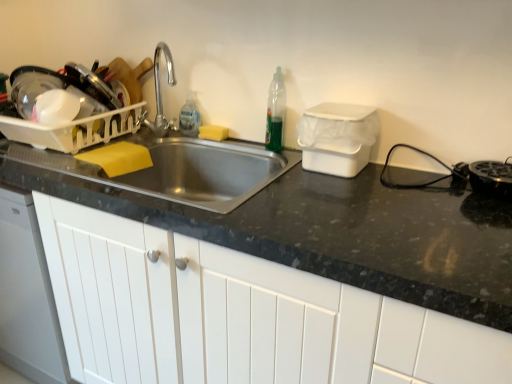
Question: From a real-world perspective, is translucent plastic bottle at sink, which is counted as the first bottle, starting from the back, above or below black plastic toaster at right, the 3th appliance positioned from the left?

Choices:
 (A) below
 (B) above

Answer: (B)

Question: Considering the positions of point (194, 117) and point (490, 167), is point (194, 117) closer or farther from the camera than point (490, 167)?

Choices:
 (A) farther
 (B) closer

Answer: (A)

Question: Which of these objects is positioned farthest from the white plastic dish rack at left, which ranks as the first appliance in left-to-right order?

Choices:
 (A) translucent plastic bottle at sink, marked as the 2th bottle in a right-to-left arrangement
 (B) green translucent bottle at upper right, marked as the 2th bottle in a left-to-right arrangement
 (C) black plastic toaster at right, the 3th appliance positioned from the left
 (D) white plastic container at upper right, arranged as the second appliance when viewed from the left
 (E) yellow sponge at sink

Answer: (C)

Question: Estimate the real-world distances between objects in this image. Which object is closer to the white matte cabinet at center?

Choices:
 (A) yellow sponge at sink
 (B) translucent plastic bottle at sink, the first bottle from the left
 (C) black plastic toaster at right, the 3th appliance positioned from the left
 (D) white plastic dish rack at left, placed as the 3th appliance when sorted from right to left
 (E) white plastic container at upper right, arranged as the second appliance when viewed from the left

Answer: (E)